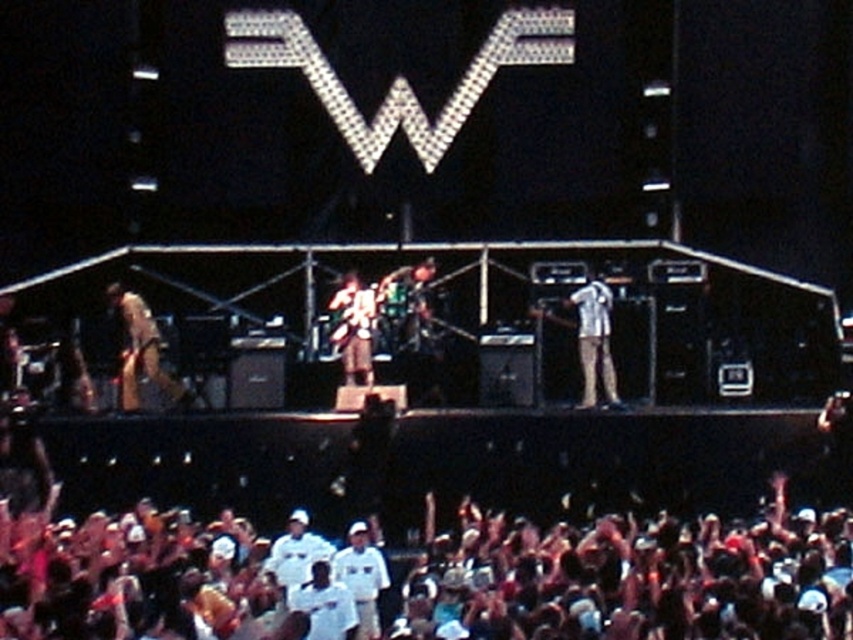
Based on the photo, you are a photographer at the concert. You want to capture a photo that includes both the light brown leather guitar at left and the light blue denim jeans at center. Which object should you focus on first to ensure both are in frame?

The light brown leather guitar at left is bigger than the light blue denim jeans at center, so you should focus on the light brown leather guitar at left first to ensure both fit within the frame.

You are a photographer at the concert and want to capture both the light blue denim jeans at center and the dark brown leather jacket at center in a single photo. Which object should you position to the left side of your frame to ensure both are included?

To include both the light blue denim jeans at center and the dark brown leather jacket at center in your photo, you should position the dark brown leather jacket at center on the left side of your frame. Since the light blue denim jeans at center is already on the right side of the dark brown leather jacket at center, this arrangement will ensure both are captured.

Based on the photo, you are standing at the point with coordinates point [610,321] and want to move to the point with coordinates point [148,371]. According to the scene description, will you be moving towards the stage or away from it?

Point [148,371] is behind point [610,321], so moving from point [610,321] to point [148,371] means you are moving away from the stage.